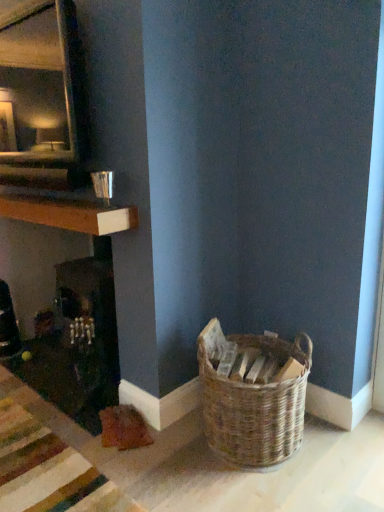
Question: Is woven brown basket at lower right far from wooden at left?

Choices:
 (A) yes
 (B) no

Answer: (B)

Question: From the image's perspective, is woven brown basket at lower right located above wooden at left?

Choices:
 (A) no
 (B) yes

Answer: (A)

Question: Can we say woven brown basket at lower right lies outside wooden at left?

Choices:
 (A) no
 (B) yes

Answer: (B)

Question: From a real-world perspective, is woven brown basket at lower right located higher than wooden at left?

Choices:
 (A) yes
 (B) no

Answer: (B)

Question: Is the depth of woven brown basket at lower right less than that of wooden at left?

Choices:
 (A) no
 (B) yes

Answer: (B)

Question: Can you confirm if woven brown basket at lower right is smaller than wooden at left?

Choices:
 (A) no
 (B) yes

Answer: (A)

Question: Is wooden at left directly adjacent to woven brown basket at lower right?

Choices:
 (A) no
 (B) yes

Answer: (A)

Question: Considering the relative positions of wooden at left and woven brown basket at lower right in the image provided, is wooden at left to the right of woven brown basket at lower right from the viewer's perspective?

Choices:
 (A) no
 (B) yes

Answer: (A)

Question: From the image's perspective, does wooden at left appear higher than woven brown basket at lower right?

Choices:
 (A) yes
 (B) no

Answer: (A)

Question: Does wooden at left come in front of woven brown basket at lower right?

Choices:
 (A) yes
 (B) no

Answer: (B)

Question: Would you say wooden at left contains woven brown basket at lower right?

Choices:
 (A) yes
 (B) no

Answer: (B)

Question: Is wooden at left thinner than woven brown basket at lower right?

Choices:
 (A) no
 (B) yes

Answer: (B)

Question: Considering the positions of wooden at left and woven brown basket at lower right in the image, is wooden at left bigger or smaller than woven brown basket at lower right?

Choices:
 (A) big
 (B) small

Answer: (B)